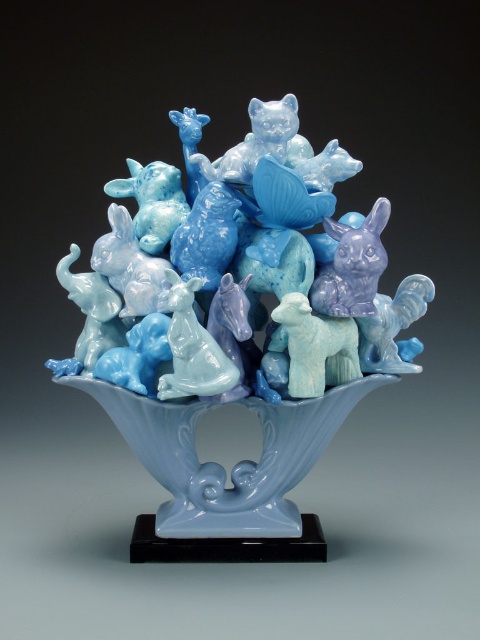
You are an art curator examining the sculpture. You need to place a label next to the matte porcelain animals at center and the light blue glass bowl at center. According to their positions, which object should the label for the animals be placed to the left of?

The label for the matte porcelain animals at center should be placed to the left of the light blue glass bowl at center because the matte porcelain animals at center are positioned to the left of the light blue glass bowl at center.

You are an interior designer arranging a living room display. You have two items to place on a shelf that can only hold one of them due to space constraints. The items are the matte porcelain animals at center and the light blue glass bowl at center. Based on their sizes, which item should you choose to fit on the shelf?

The light blue glass bowl at center should be chosen because the matte porcelain animals at center is larger in size and would not fit on the shelf.

You are a delivery person who needs to carefully pack the light blue glass bowl at center and the matte porcelain animals at center into a box. The box has a height limit of 3.5 inches to fit in the delivery truck. Will the combined height of both items exceed the box limit?

The distance between the matte porcelain animals at center and the light blue glass bowl at center is 3.29 inches. Since the combined height of both items would be approximately 3.29 inches, which is under the 3.5 inches limit, they can be safely packed together without exceeding the height restriction.